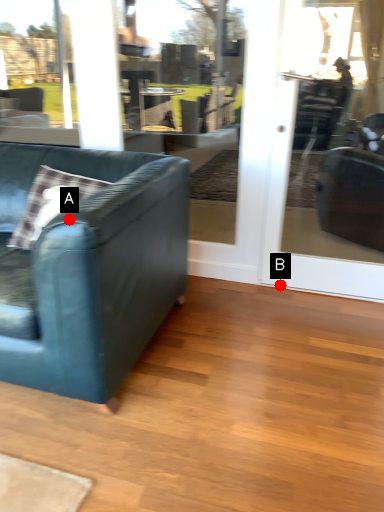
Question: Two points are circled on the image, labeled by A and B beside each circle. Which of the following is the farthest from the observer?

Choices:
 (A) A is further
 (B) B is further

Answer: (B)